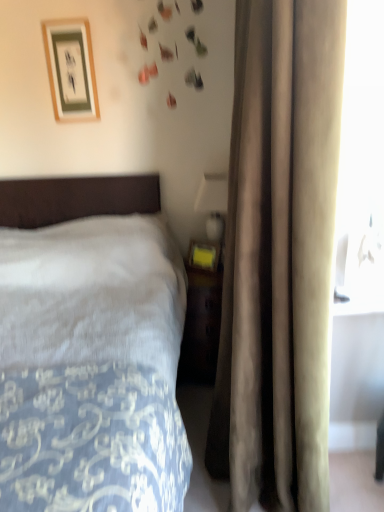
Question: Should I look upward or downward to see beige velvet curtain at right?

Choices:
 (A) down
 (B) up

Answer: (B)

Question: Is matte gold picture frame at upper left at the back of matte yellow plastic at right?

Choices:
 (A) yes
 (B) no

Answer: (B)

Question: From the image's perspective, is matte yellow plastic at right on top of matte gold picture frame at upper left?

Choices:
 (A) no
 (B) yes

Answer: (A)

Question: Are matte yellow plastic at right and matte gold picture frame at upper left making contact?

Choices:
 (A) no
 (B) yes

Answer: (A)

Question: Considering the relative sizes of matte yellow plastic at right and matte gold picture frame at upper left in the image provided, is matte yellow plastic at right smaller than matte gold picture frame at upper left?

Choices:
 (A) no
 (B) yes

Answer: (A)

Question: Considering the relative sizes of matte yellow plastic at right and matte gold picture frame at upper left in the image provided, is matte yellow plastic at right taller than matte gold picture frame at upper left?

Choices:
 (A) no
 (B) yes

Answer: (B)

Question: Does matte yellow plastic at right lie in front of matte gold picture frame at upper left?

Choices:
 (A) no
 (B) yes

Answer: (B)

Question: Can you confirm if matte yellow plastic at right is positioned to the right of beige velvet curtain at right?

Choices:
 (A) yes
 (B) no

Answer: (B)

Question: Can you confirm if matte yellow plastic at right is bigger than beige velvet curtain at right?

Choices:
 (A) no
 (B) yes

Answer: (A)

Question: Considering the relative sizes of matte yellow plastic at right and beige velvet curtain at right in the image provided, is matte yellow plastic at right shorter than beige velvet curtain at right?

Choices:
 (A) yes
 (B) no

Answer: (A)

Question: Is matte yellow plastic at right not near beige velvet curtain at right?

Choices:
 (A) no
 (B) yes

Answer: (A)

Question: Can we say matte yellow plastic at right lies outside beige velvet curtain at right?

Choices:
 (A) yes
 (B) no

Answer: (B)

Question: Considering the relative sizes of matte yellow plastic at right and beige velvet curtain at right in the image provided, is matte yellow plastic at right taller than beige velvet curtain at right?

Choices:
 (A) yes
 (B) no

Answer: (B)

Question: Does white soft bed at left have a larger size compared to matte gold picture frame at upper left?

Choices:
 (A) yes
 (B) no

Answer: (A)